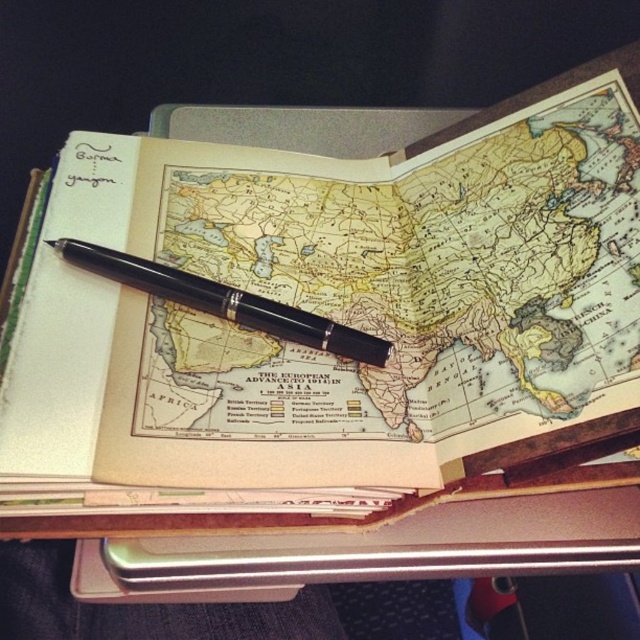
You are a student who needs to write notes about the map. The map is placed on a desk. You have a matte paper notebook at center and a black polished pen at center. Which object is closer to you when looking straight down?

The matte paper notebook at center is closer to you because it is positioned above the black polished pen at center.

You are an archaeologist who needs to take notes on the vintage map. You have a matte paper notebook at center and a black polished pen at center. Which object do you need to use to write down your observations?

You need to use the black polished pen at center to write down your observations because the matte paper notebook at center is for writing, but the pen is the tool needed to write. However, the question might be better phrased to focus on spatial or comparative details from the Objects Description.

You are a researcher studying the map and need to place a bookmark exactly at the point marked by point (330, 310). What object is located at that point?

The point (330, 310) marks the matte paper notebook at center.